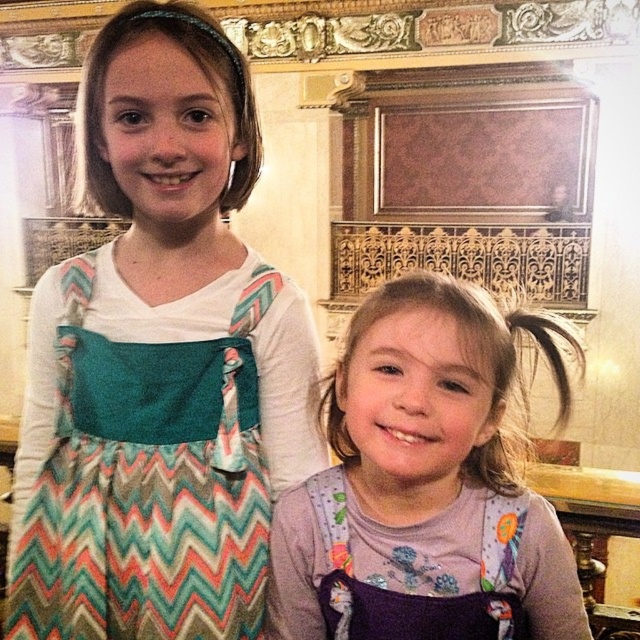
Does purple fabric overalls at center appear over chevron-patterned fabric apron at left?

No, purple fabric overalls at center is not above chevron-patterned fabric apron at left.

Between point (292, 612) and point (32, 582), which one is positioned behind?

The point (32, 582) is behind.

Is point (412, 612) more distant than point (12, 632)?

No.

Where is `purple fabric overalls at center`? The width and height of the screenshot is (640, 640). purple fabric overalls at center is located at coordinates (426, 484).